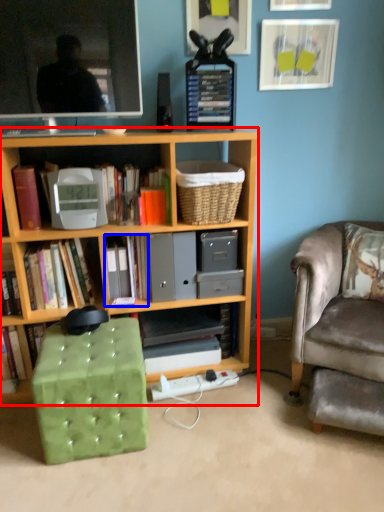
Question: Which point is further to the camera, bookcase (highlighted by a red box) or book (highlighted by a blue box)?

Choices:
 (A) bookcase
 (B) book

Answer: (B)